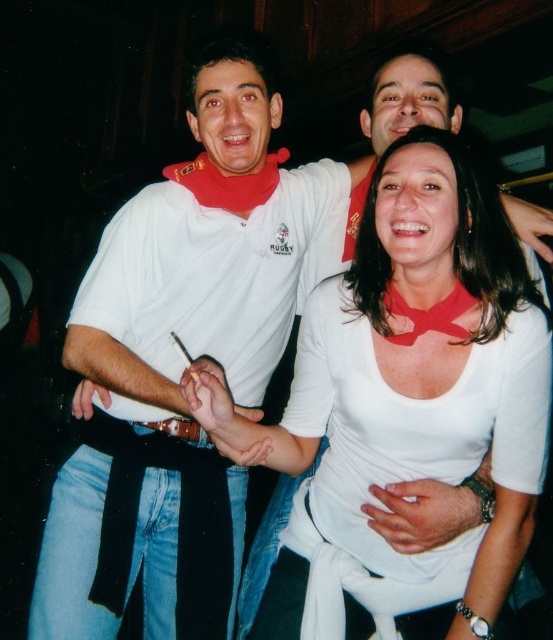
Question: Does white matte shirt at center appear on the left side of brown leather belt at lower center?

Choices:
 (A) yes
 (B) no

Answer: (B)

Question: Which of the following is the closest to the observer?

Choices:
 (A) (190, 420)
 (B) (418, 240)

Answer: (B)

Question: Does white matte shirt at center lie behind brown leather belt at lower center?

Choices:
 (A) no
 (B) yes

Answer: (A)

Question: Among these objects, which one is farthest from the camera?

Choices:
 (A) white matte shirt at center
 (B) brown leather belt at lower center

Answer: (B)

Question: In this image, where is white matte shirt at center located relative to brown leather belt at lower center?

Choices:
 (A) above
 (B) below

Answer: (A)